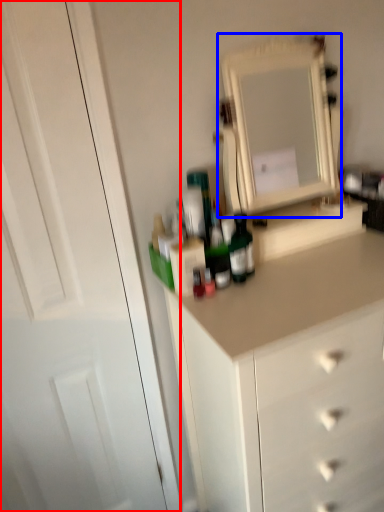
Question: Which object appears closest to the camera in this image, glass door (highlighted by a red box) or medicine cabinet (highlighted by a blue box)?

Choices:
 (A) glass door
 (B) medicine cabinet

Answer: (A)